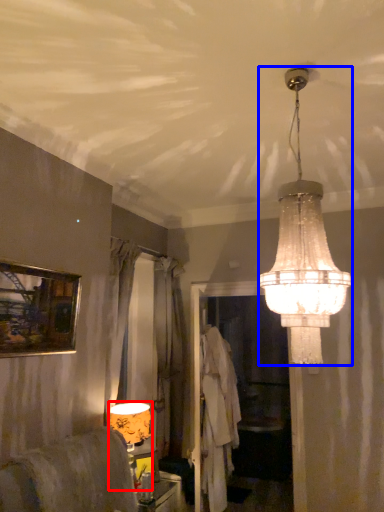
Question: Among these objects, which one is farthest to the camera, lamp (highlighted by a red box) or lamp (highlighted by a blue box)?

Choices:
 (A) lamp
 (B) lamp

Answer: (A)